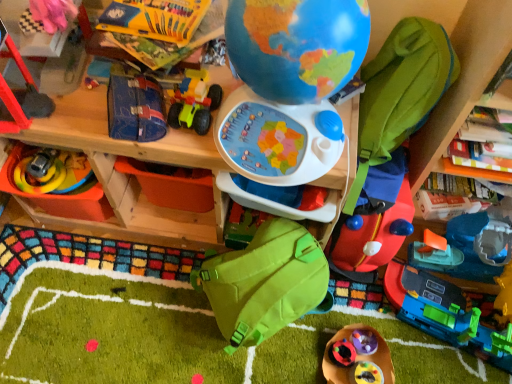
Identify the location of free space to the back side of matte plastic toy at lower center, which is counted as the 4th toy, starting from the right. (364, 342).